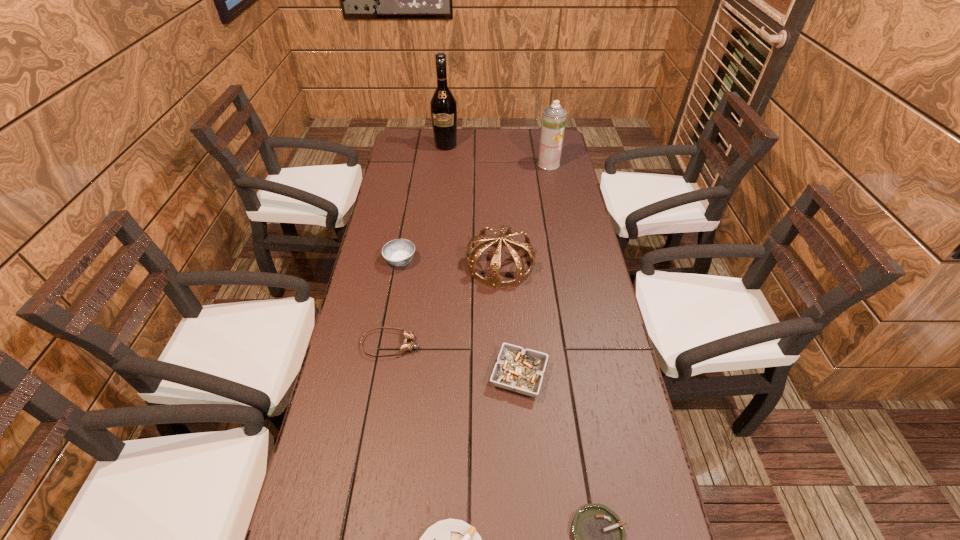
You are a GUI agent. You are given a task and a screenshot of the screen. Output one action in this format:
    pyautogui.click(x=<x>, y=<y>)
    Task: Click on the blank area in the image that satisfies the following two spatial constraints: 1. on the back side of the second ashtray from right to left; 2. on the right side of the second tallest object
    This screenshot has height=540, width=960.
    Given the screenshot: What is the action you would take?
    pyautogui.click(x=504, y=164)

What are the coordinates of `vacant space that satisfies the following two spatial constraints: 1. on the label of the wine bottle; 2. on the right side of the tiara` in the screenshot? It's located at (433, 265).

Locate an element on the screen. Image resolution: width=960 pixels, height=540 pixels. vacant area in the image that satisfies the following two spatial constraints: 1. on the label of the sixth shortest object; 2. on the right side of the tallest object is located at coordinates (433, 265).